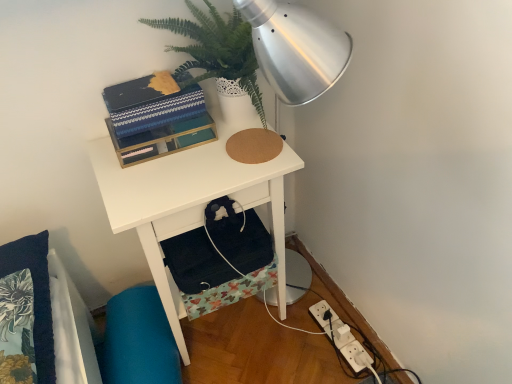
The height and width of the screenshot is (384, 512). In order to click on blank space above teal fabric swivel chair at lower left (from a real-world perspective) in this screenshot , I will do `click(133, 340)`.